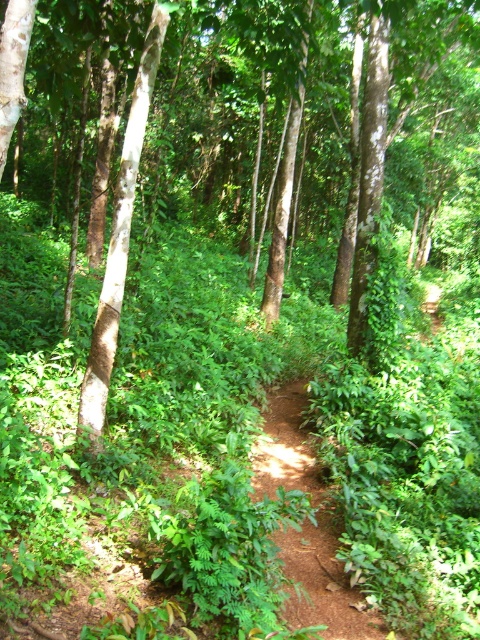
Can you confirm if brown smooth tree at center is positioned to the left of brown dirt path at center?

Indeed, brown smooth tree at center is positioned on the left side of brown dirt path at center.

Who is shorter, brown smooth tree at center or brown dirt path at center?

With less height is brown dirt path at center.

Identify the location of brown smooth tree at center. This screenshot has width=480, height=640. (241, 124).

In order to click on brown smooth tree at center in this screenshot , I will do `click(241, 124)`.